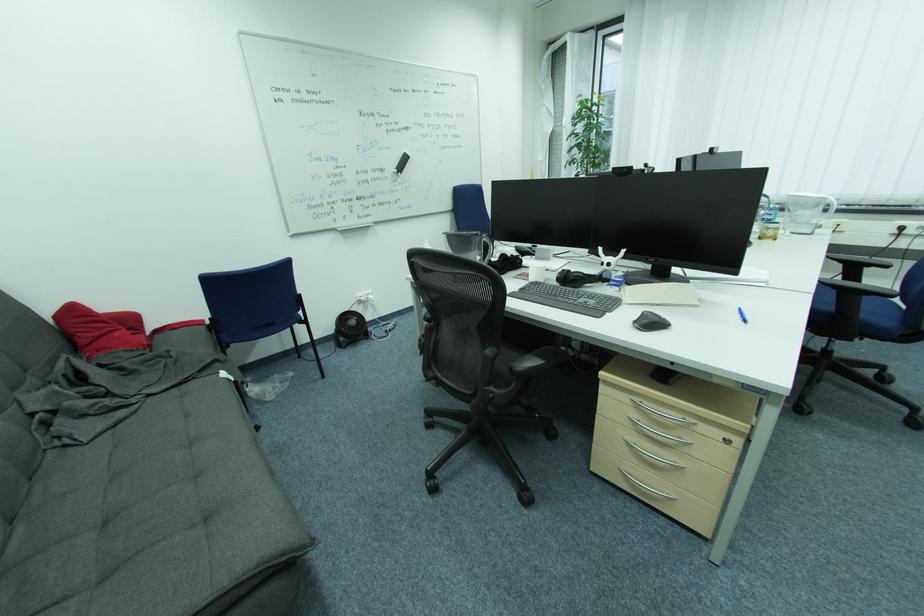
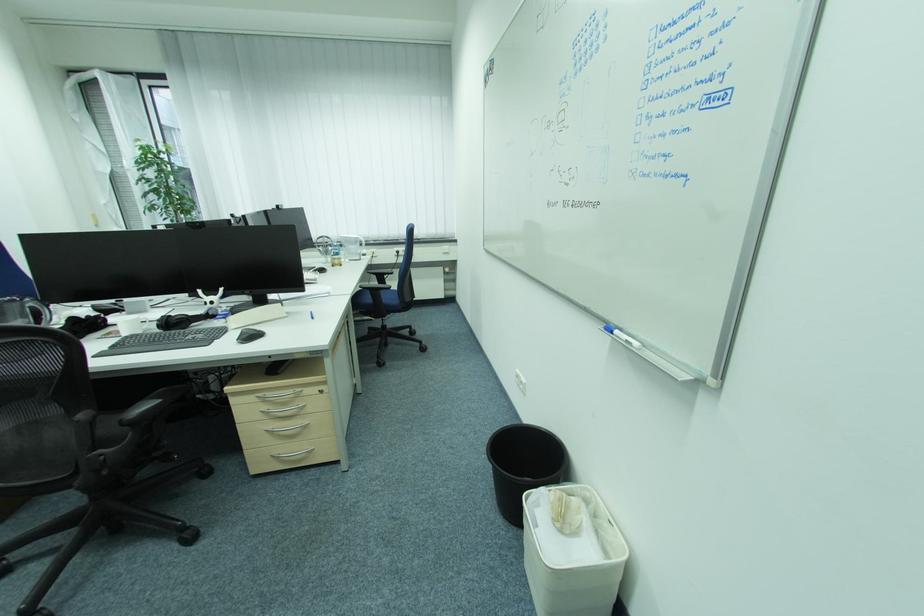
In the second image, find the point that corresponds to point (641, 416) in the first image.

(272, 408)